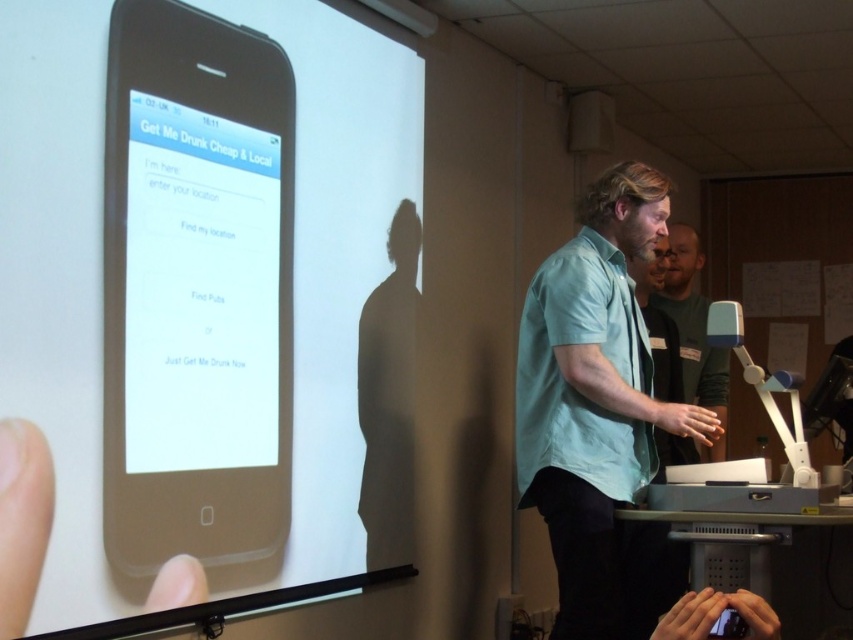
You are standing in the presentation room and want to find the light blue cotton shirt at center. According to the coordinates provided, where should you look?

The light blue cotton shirt at center is located at point (602, 410), so you should look there.

You are attending a tech presentation and notice the matte black phone at upper left and the dark green shirt at right. From your seat in the audience, which object is closer to you?

The matte black phone at upper left is closer to you because it is in front of the dark green shirt at right.

You are attending a presentation and notice two presenters wearing the light blue cotton shirt at center and the dark green shirt at right. Based on their positions, which presenter is standing closer to the front of the stage?

The light blue cotton shirt at center is located below the dark green shirt at right, which means the presenter in the light blue cotton shirt at center is standing closer to the front of the stage.